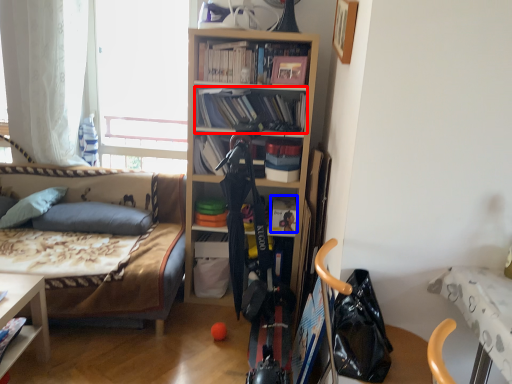
Question: Which point is further to the camera, book (highlighted by a red box) or book (highlighted by a blue box)?

Choices:
 (A) book
 (B) book

Answer: (B)